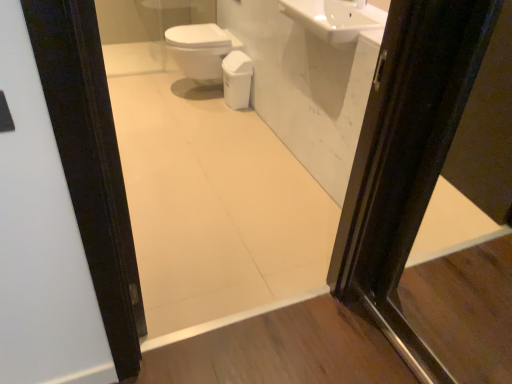
Question: From their relative heights in the image, would you say white glossy sink at upper center is taller or shorter than white glossy bidet at center?

Choices:
 (A) short
 (B) tall

Answer: (A)

Question: From the image's perspective, is white glossy sink at upper center located above or below white glossy bidet at center?

Choices:
 (A) above
 (B) below

Answer: (B)

Question: Considering the real-world distances, which object is closest to the white glossy mirror at upper center?

Choices:
 (A) white glossy bidet at center
 (B) white glossy sink at upper center
 (C) white glossy toilet bowl at center

Answer: (B)

Question: Which object is the farthest from the white glossy toilet bowl at center?

Choices:
 (A) white glossy bidet at center
 (B) white glossy mirror at upper center
 (C) white glossy sink at upper center

Answer: (C)